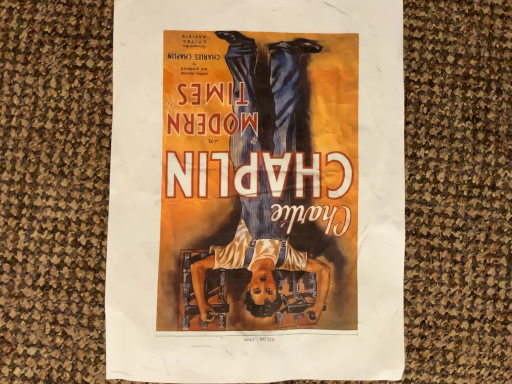
Describe the element at coordinates (256, 191) in the screenshot. The height and width of the screenshot is (384, 512). I see `matte paper poster at center` at that location.

Image resolution: width=512 pixels, height=384 pixels. Find the location of `matte paper poster at center`. matte paper poster at center is located at coordinates (256, 191).

Locate an element on the screen. matte paper poster at center is located at coordinates (256, 191).